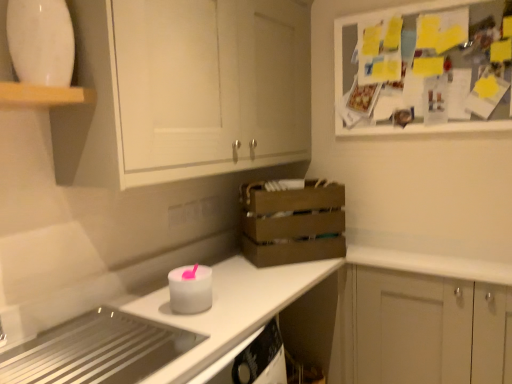
Locate an element on the screen. This screenshot has height=384, width=512. free space above white matte cabinet at lower right, arranged as the second cabinetry when viewed from the top (from a real-world perspective) is located at coordinates (424, 257).